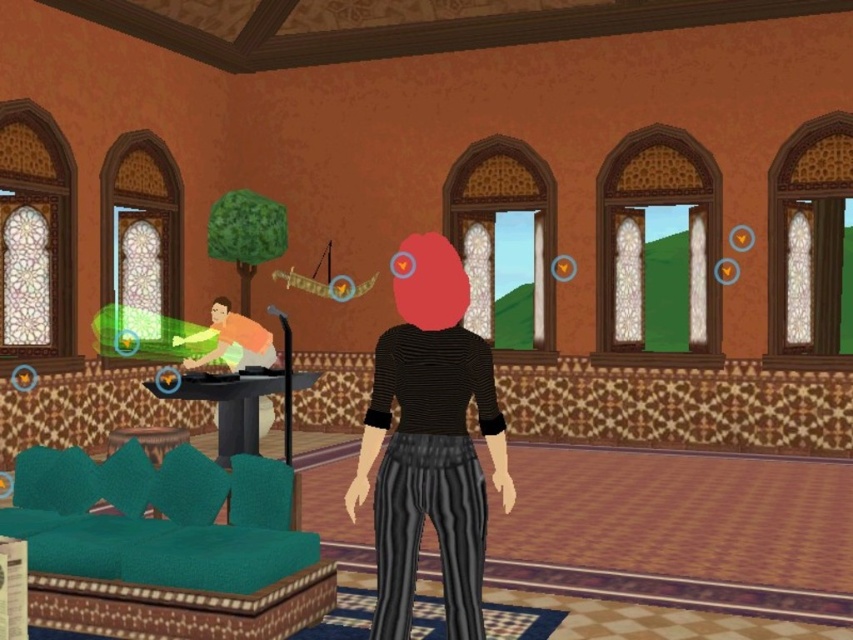
You are navigating a virtual room with a teal sofa and a round table. You need to move from point A to point B. Point A is at coordinates point [486,388] and point B is at coordinates point [253,400]. Which point is closer to you when you first enter the room?

Point [486,388] is closer to the viewer than point [253,400], so point A is closer when you first enter the room.

You are standing in the center of the room. The teal fabric couch at lower left is located at coordinates point (167, 545). If you face the direction of the teal fabric couch at lower left, which wall would be directly in front of you?

The teal fabric couch at lower left is located at point (167, 545). Since the room has warm orange walls with intricate geometric patterns at the base, the wall directly in front of you when facing the teal fabric couch at lower left would be the wall with the warm orange walls with intricate geometric patterns at the base.

You are standing in the room and want to know how far the point at coordinates [123,532] is from your current position. Can you determine the distance?

The point at coordinates [123,532] is 17.97 feet away from your current position.